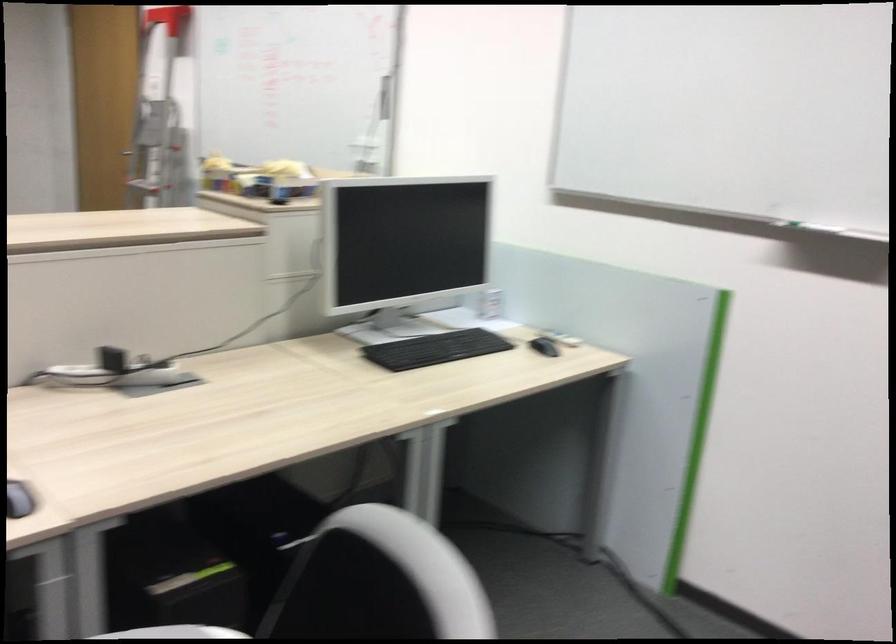
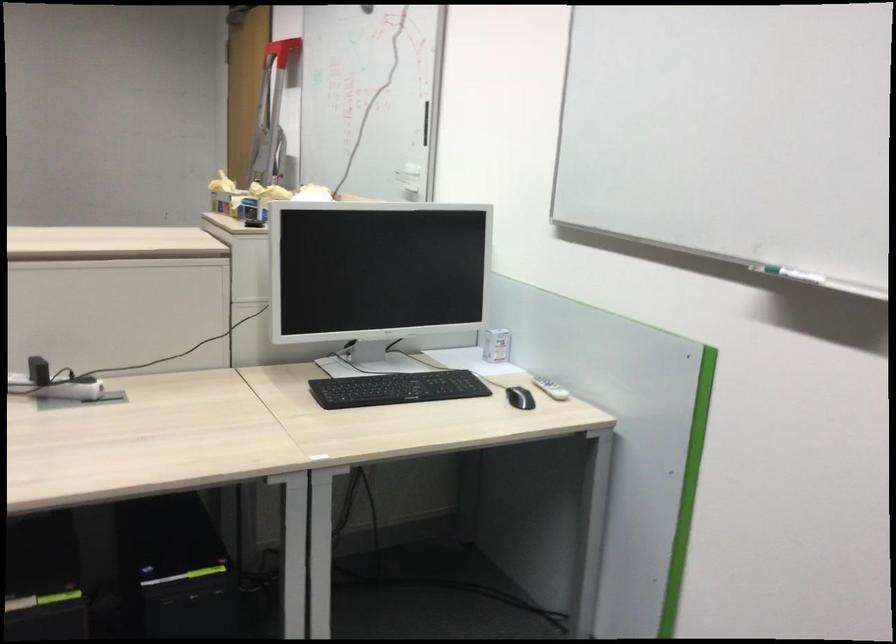
Locate, in the second image, the point that corresponds to pixel 495 305 in the first image.

(495, 345)